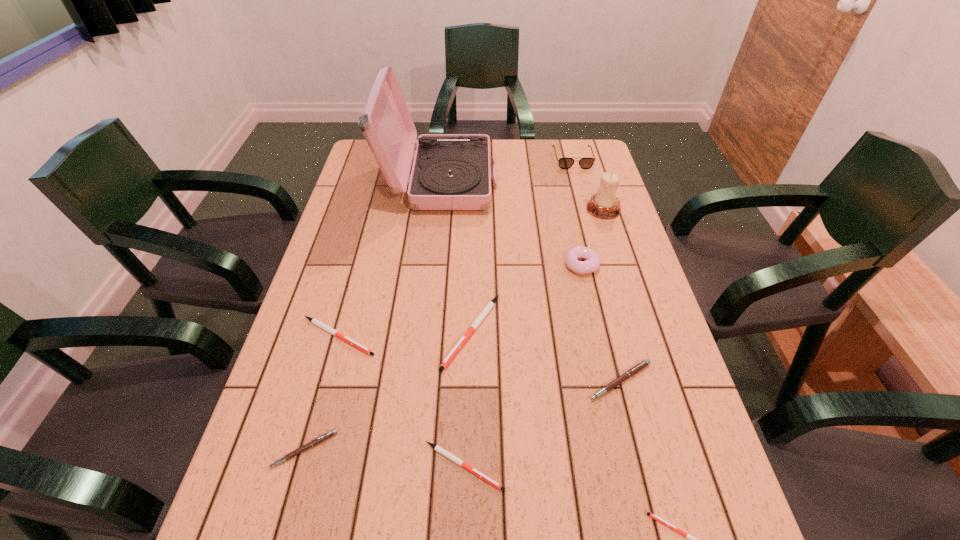
Image resolution: width=960 pixels, height=540 pixels. Find the location of `the leftmost white pen`. the leftmost white pen is located at coordinates (316, 322).

Find the location of a particular element. the nearer pink pen is located at coordinates (327, 435).

Find the location of a particular element. Image resolution: width=960 pixels, height=540 pixels. the smaller pink pen is located at coordinates (327, 435).

Where is `the third farthest white pen`? This screenshot has width=960, height=540. the third farthest white pen is located at coordinates (437, 448).

Where is `free space located 0.300m with the lid open on the tallest object`? free space located 0.300m with the lid open on the tallest object is located at coordinates (584, 181).

Where is `free space located on the left of the ninth shortest object`? This screenshot has height=540, width=960. free space located on the left of the ninth shortest object is located at coordinates (570, 209).

At what (x,y) coordinates should I click in order to perform the action: click on free location located on the front-facing side of the black spectacles. Please return your answer as a coordinate pair (x, y). Image resolution: width=960 pixels, height=540 pixels. Looking at the image, I should click on (582, 194).

Locate an element on the screen. The image size is (960, 540). free space located on the back of the doughnut is located at coordinates (563, 183).

Identify the location of free location located 0.050m on the clicker of the biggest white pen. The width and height of the screenshot is (960, 540). (470, 394).

Find the location of a particular element. free spot located at the nib of the right pink pen is located at coordinates (657, 526).